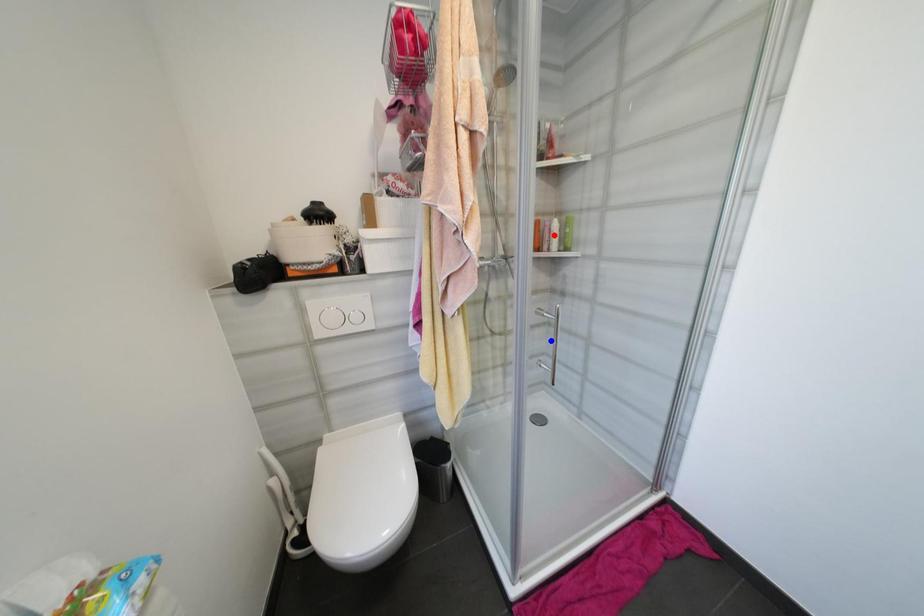
Question: Which of the two points in the image is closer to the camera?

Choices:
 (A) Blue point is closer.
 (B) Red point is closer.

Answer: (A)